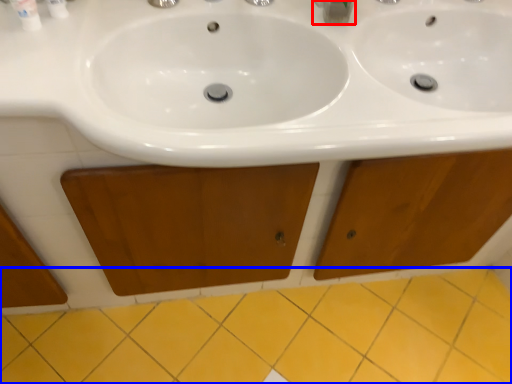
Question: Which object appears farthest to the camera in this image, plumbing fixture (highlighted by a red box) or ceramic tile (highlighted by a blue box)?

Choices:
 (A) plumbing fixture
 (B) ceramic tile

Answer: (B)